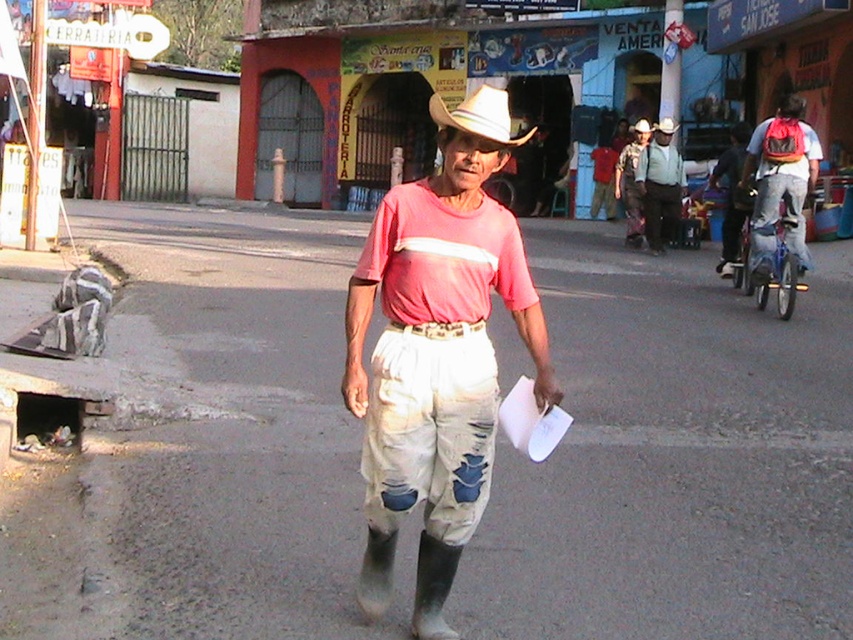
Question: Is matte pink shirt at center in front of matte red shirt at center?

Choices:
 (A) no
 (B) yes

Answer: (B)

Question: Does red backpack at right have a smaller size compared to dark blue jeans at right?

Choices:
 (A) yes
 (B) no

Answer: (A)

Question: Which point is closer to the camera?

Choices:
 (A) matte pink shirt at center
 (B) dark blue jeans at right
 (C) light blue denim shirt at center
 (D) red backpack at right

Answer: (A)

Question: Based on their relative distances, which object is nearer to the matte red shirt at center?

Choices:
 (A) ripped denim pants at center
 (B) light blue denim shirt at center

Answer: (A)

Question: Which of the following is the closest to the observer?

Choices:
 (A) (592, 212)
 (B) (392, 493)
 (C) (776, 198)
 (D) (636, 193)

Answer: (B)

Question: Does white felt cowboy hat at center appear on the right side of ripped denim pants at center?

Choices:
 (A) yes
 (B) no

Answer: (B)